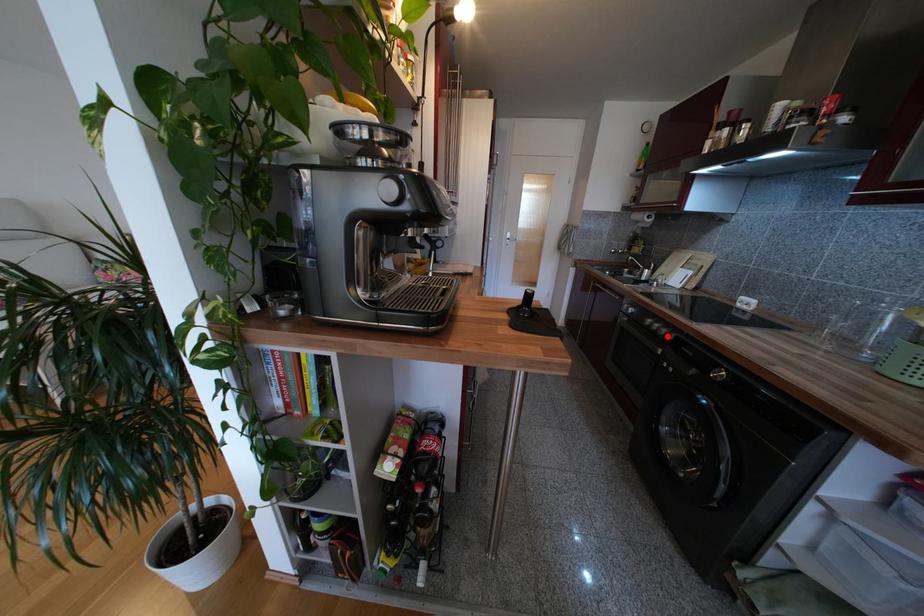
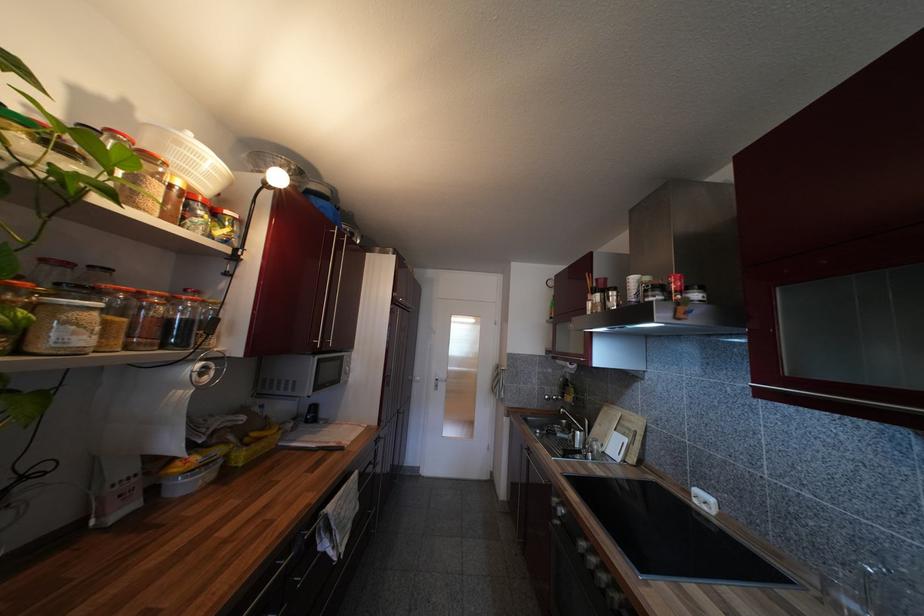
The point at the highlighted location is marked in the first image. Where is the corresponding point in the second image?

(609, 590)